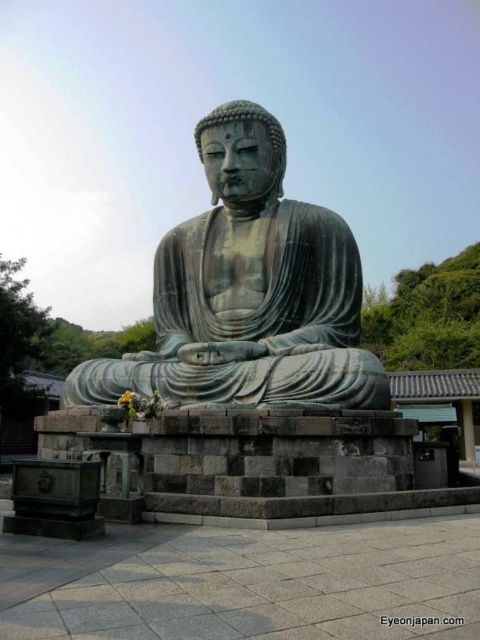
Question: Which point is farther from the camera taking this photo?

Choices:
 (A) (358, 257)
 (B) (424, 618)

Answer: (A)

Question: Among these points, which one is nearest to the camera?

Choices:
 (A) (389, 624)
 (B) (184, 227)

Answer: (A)

Question: Does green patina stone statue at center have a larger size compared to matte bronze statue at center?

Choices:
 (A) no
 (B) yes

Answer: (B)

Question: Does green patina stone statue at center have a lesser width compared to matte bronze statue at center?

Choices:
 (A) no
 (B) yes

Answer: (A)

Question: Does green patina stone statue at center have a greater width compared to matte bronze statue at center?

Choices:
 (A) no
 (B) yes

Answer: (B)